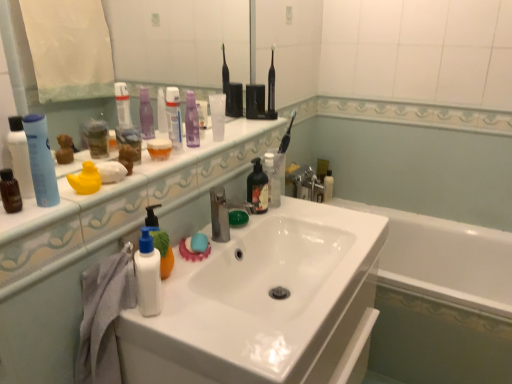
Image resolution: width=512 pixels, height=384 pixels. Identify the location of space that is in front of rubber duck at left, placed as the 4th toiletry when sorted from right to left. (49, 213).